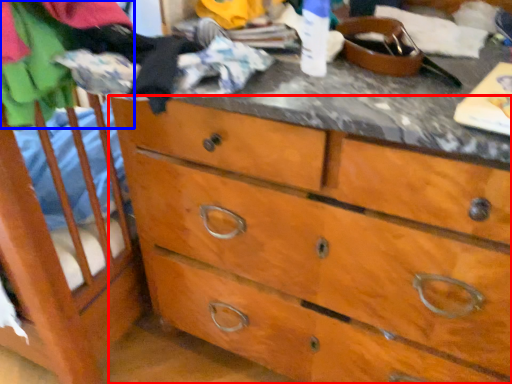
Question: Which object appears closest to the camera in this image, chest of drawers (highlighted by a red box) or clothing (highlighted by a blue box)?

Choices:
 (A) chest of drawers
 (B) clothing

Answer: (A)